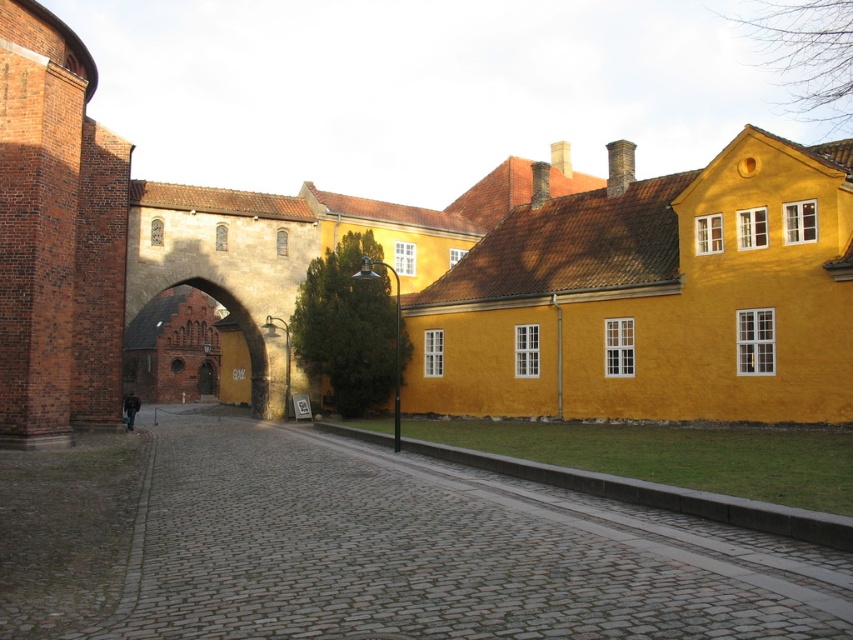
Question: Among these points, which one is farthest from the camera?

Choices:
 (A) (161, 320)
 (B) (595, 611)

Answer: (A)

Question: Which point is closer to the camera taking this photo?

Choices:
 (A) (61, 458)
 (B) (136, 378)

Answer: (A)

Question: Is cobblestone alley at center bigger than brown stone archway at center?

Choices:
 (A) yes
 (B) no

Answer: (B)

Question: Which point appears closest to the camera in this image?

Choices:
 (A) (180, 605)
 (B) (181, 292)

Answer: (A)

Question: Is cobblestone alley at center below brown stone archway at center?

Choices:
 (A) no
 (B) yes

Answer: (B)

Question: Does cobblestone alley at center come in front of brown stone archway at center?

Choices:
 (A) no
 (B) yes

Answer: (B)